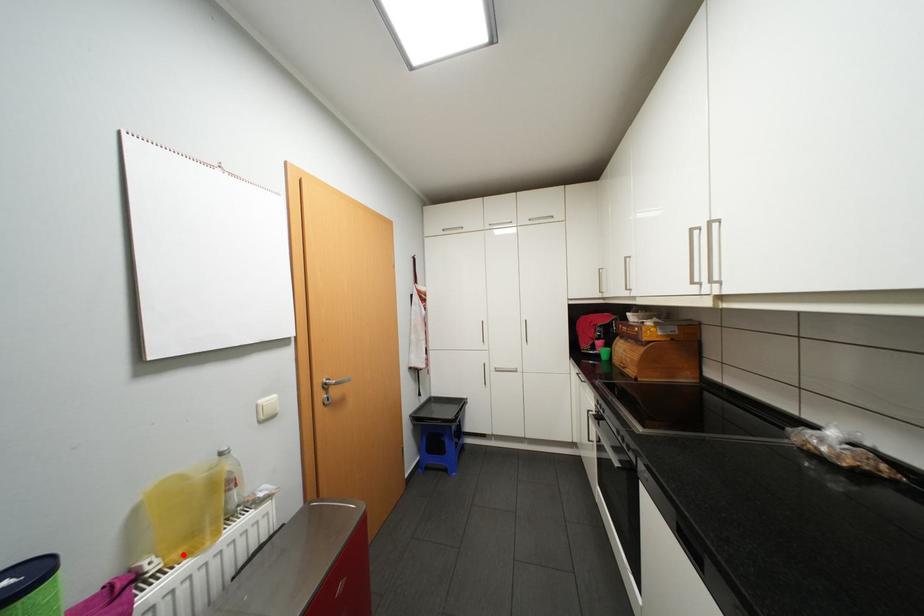
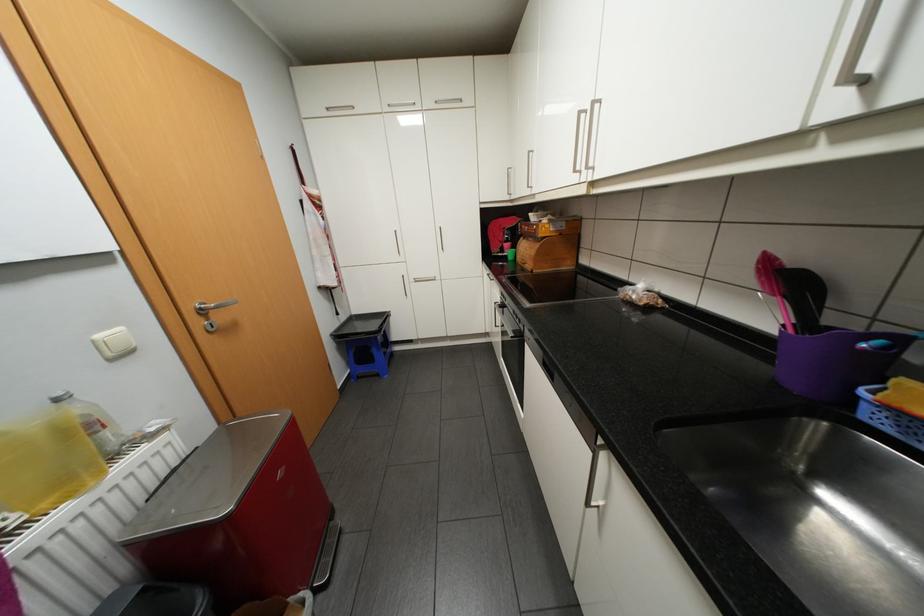
Locate, in the second image, the point that corresponds to the highlighted location in the first image.

(53, 504)